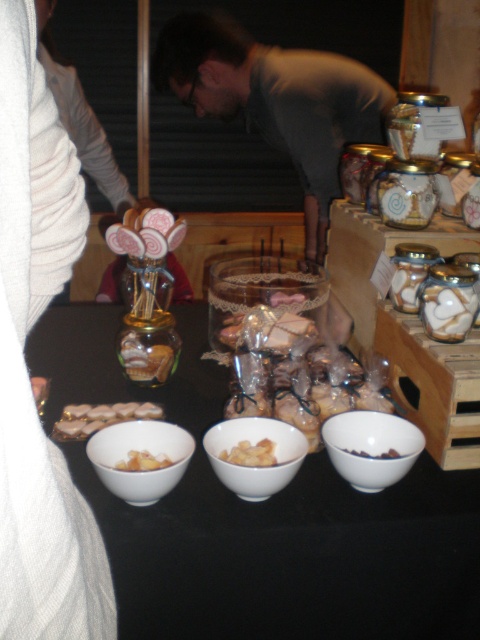
Does white sweater at lower left have a lesser height compared to brown matte bowl at center?

Incorrect, white sweater at lower left's height does not fall short of brown matte bowl at center's.

The image size is (480, 640). I want to click on white sweater at lower left, so click(24, 364).

Can you confirm if white glossy bowl at center is wider than white matte cookies at center?

Incorrect, white glossy bowl at center's width does not surpass white matte cookies at center's.

Which is more to the right, white glossy bowl at center or white matte cookies at center?

Positioned to the right is white glossy bowl at center.

Find the location of `white glossy bowl at center`. white glossy bowl at center is located at coordinates pyautogui.click(x=254, y=454).

Locate an element on the screen. Image resolution: width=480 pixels, height=640 pixels. white glossy bowl at center is located at coordinates (254, 454).

Can you confirm if white glossy bowl at center is thinner than yellow matte dried fruits at center?

No, white glossy bowl at center is not thinner than yellow matte dried fruits at center.

Between white glossy bowl at center and yellow matte dried fruits at center, which one appears on the right side from the viewer's perspective?

Positioned to the right is white glossy bowl at center.

Is point (280, 476) positioned in front of point (141, 465)?

Yes, it is in front of point (141, 465).

Find the location of `white glossy bowl at center`. white glossy bowl at center is located at coordinates (254, 454).